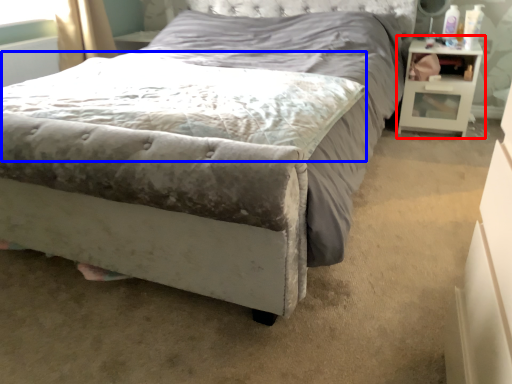
Question: Which point is closer to the camera, nightstand (highlighted by a red box) or mattress (highlighted by a blue box)?

Choices:
 (A) nightstand
 (B) mattress

Answer: (B)